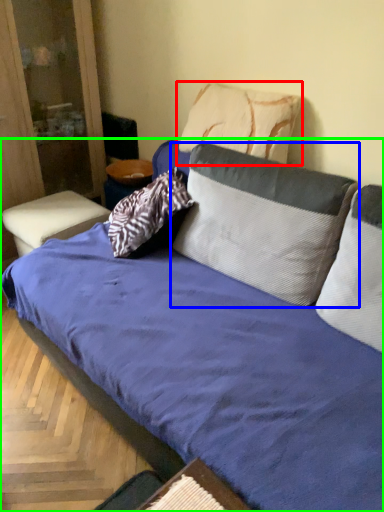
Question: Considering the real-world distances, which object is closest to pillow (highlighted by a red box)? pillow (highlighted by a blue box) or studio couch (highlighted by a green box).

Choices:
 (A) pillow
 (B) studio couch

Answer: (A)